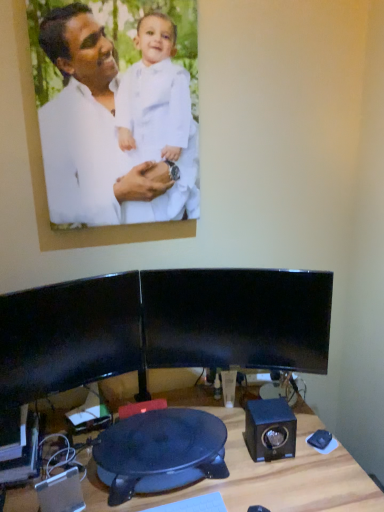
I want to click on vacant space that is in between black plastic keyboard at lower center and black plastic swivel chair at center, so click(x=192, y=498).